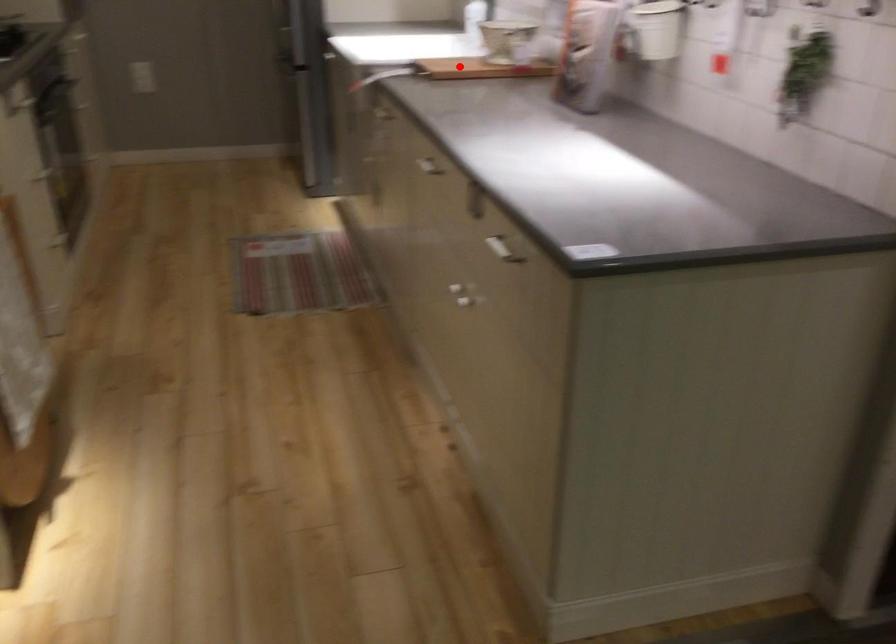
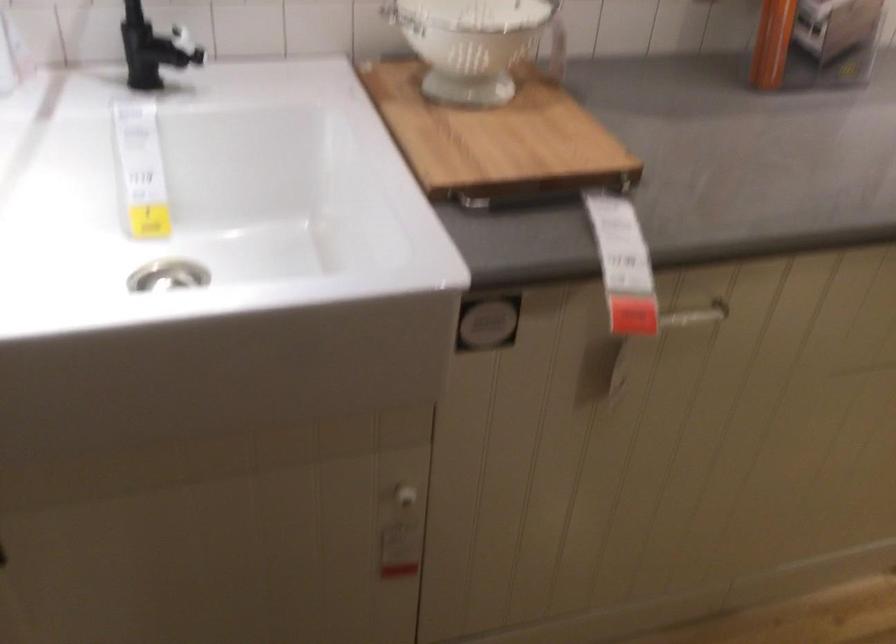
Question: I am providing you with two images of the same scene from different viewpoints. Given a red point in image1, look at the same physical point in image2. Is it:

Choices:
 (A) Closer to the viewpoint
 (B) Farther from the viewpoint

Answer: (A)